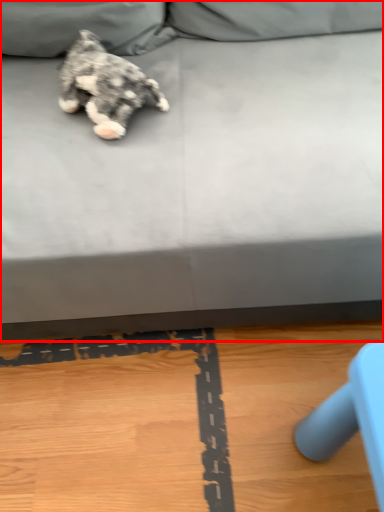
Question: From the image's perspective, what is the correct spatial relationship of studio couch (annotated by the red box) in relation to dog?

Choices:
 (A) above
 (B) below

Answer: (A)